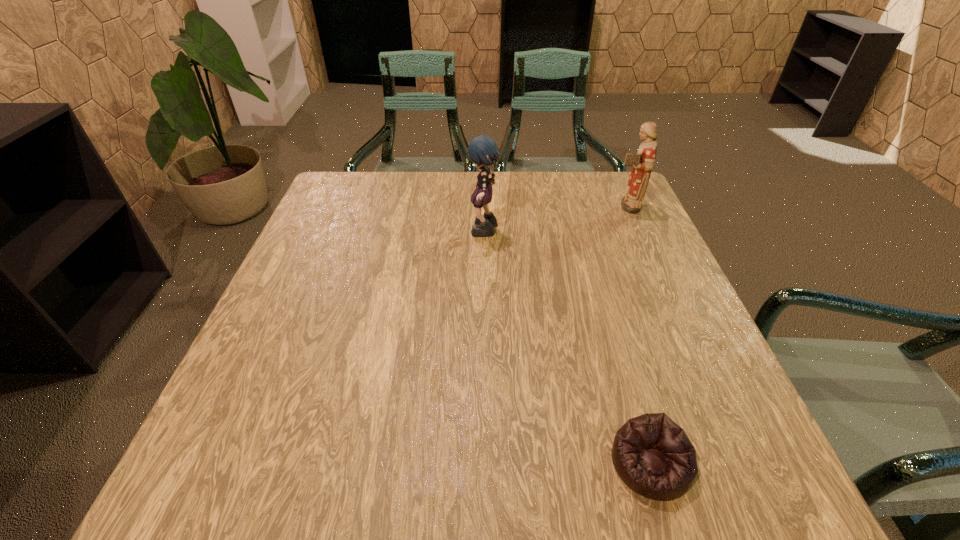
Identify the location of vacant area situated 0.220m on the front-facing side of the farthest object. The width and height of the screenshot is (960, 540). (531, 206).

The width and height of the screenshot is (960, 540). In order to click on free space located on the front-facing side of the farthest object in this screenshot , I will do `click(593, 206)`.

What are the coordinates of `vacant space located 0.110m on the left of the nearest object` in the screenshot? It's located at (540, 463).

Locate an element on the screen. The width and height of the screenshot is (960, 540). object that is positioned at the far edge is located at coordinates (643, 161).

At what (x,y) coordinates should I click in order to perform the action: click on object that is at the near edge. Please return your answer as a coordinate pair (x, y). Looking at the image, I should click on pyautogui.click(x=653, y=456).

The image size is (960, 540). I want to click on figurine that is at the right edge, so click(x=643, y=161).

At what (x,y) coordinates should I click in order to perform the action: click on beanbag that is at the right edge. Please return your answer as a coordinate pair (x, y). This screenshot has height=540, width=960. Looking at the image, I should click on (653, 456).

Find the location of `object at the far right corner`. object at the far right corner is located at coordinates (643, 161).

The width and height of the screenshot is (960, 540). Identify the location of object that is positioned at the near right corner. (653, 456).

The height and width of the screenshot is (540, 960). Identify the location of vacant space at the far edge of the desktop. (567, 206).